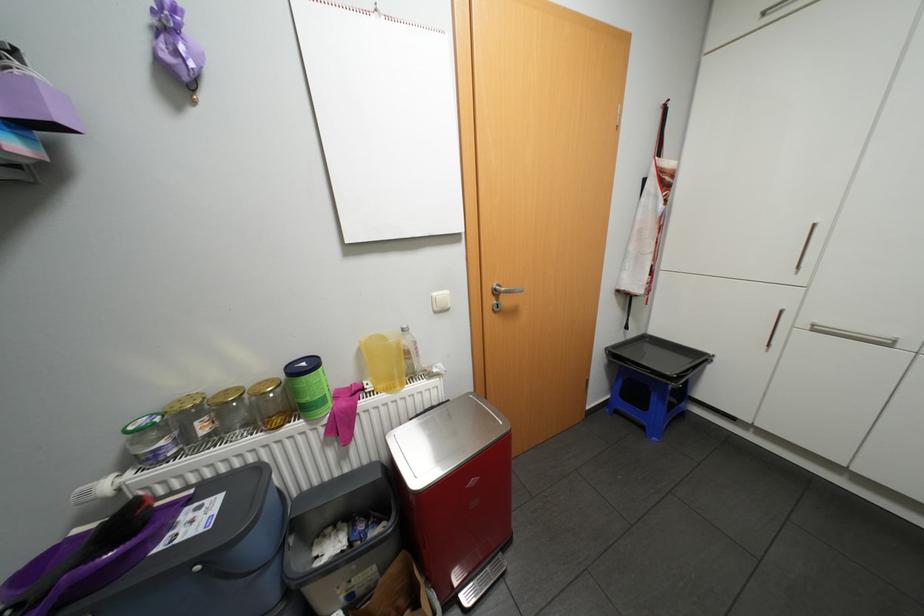
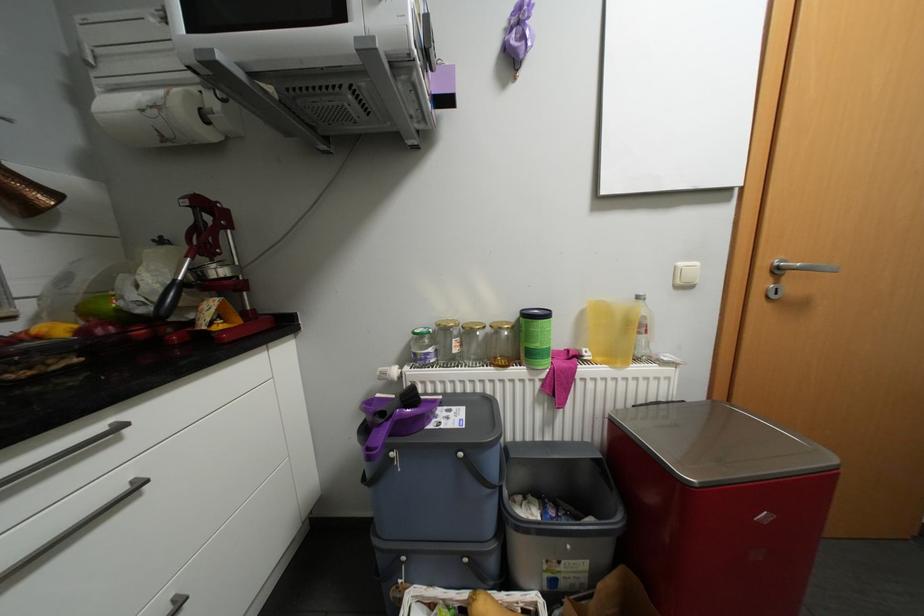
Question: How did the camera likely rotate?

Choices:
 (A) Left
 (B) Right
 (C) Up
 (D) Down

Answer: (A)